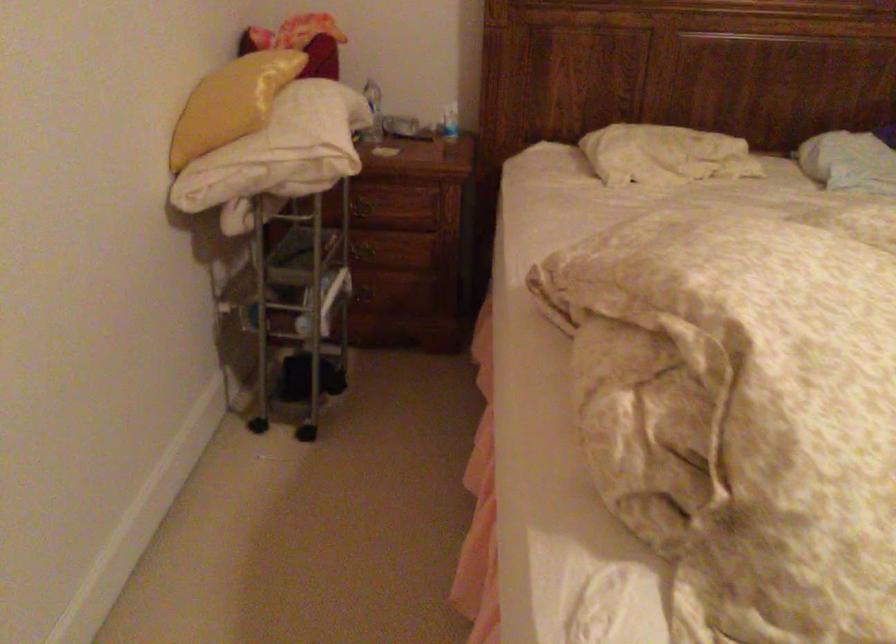
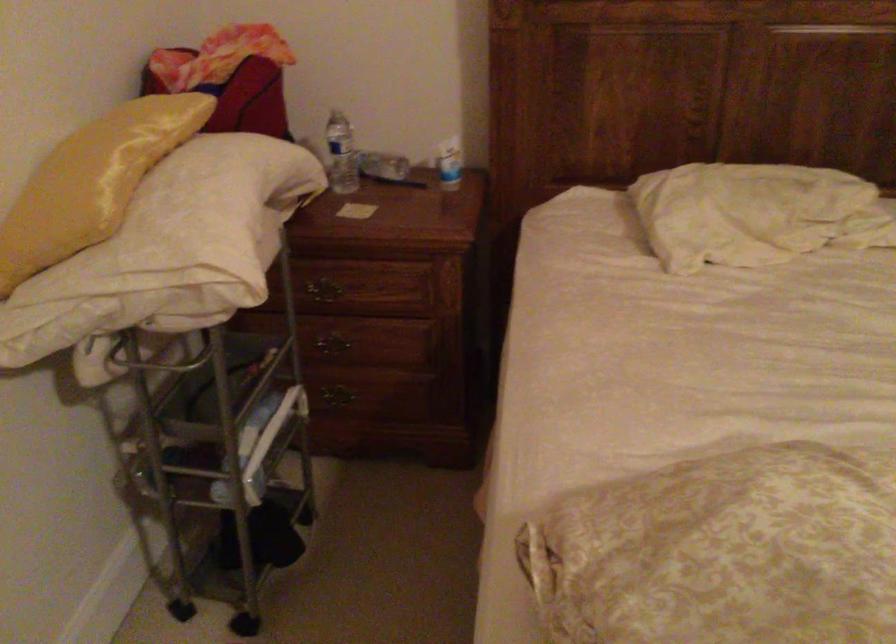
Question: The first image is from the beginning of the video and the second image is from the end. How did the camera likely rotate when shooting the video?

Choices:
 (A) Left
 (B) Right
 (C) Up
 (D) Down

Answer: (A)